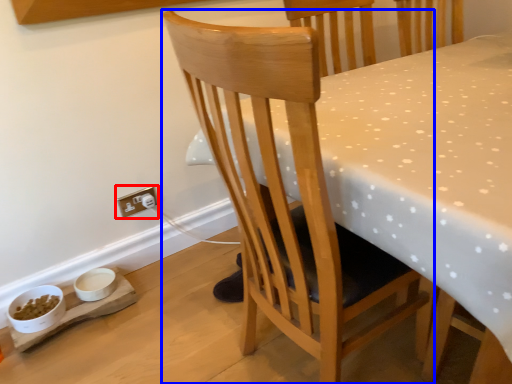
Question: Which of the following is the closest to the observer, electric outlet (highlighted by a red box) or chair (highlighted by a blue box)?

Choices:
 (A) electric outlet
 (B) chair

Answer: (B)